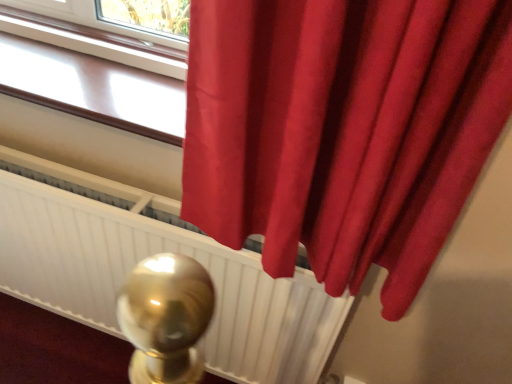
Measure the distance between white ribbed radiator at center and camera.

white ribbed radiator at center is 34.93 inches away from camera.

Measure the distance between point (66, 251) and camera.

Point (66, 251) is 1.16 meters away from camera.

What do you see at coordinates (146, 256) in the screenshot? I see `white ribbed radiator at center` at bounding box center [146, 256].

You are a GUI agent. You are given a task and a screenshot of the screen. Output one action in this format:
    pyautogui.click(x=<x>, y=<y>)
    Task: Click on the white ribbed radiator at center
    
    Given the screenshot: What is the action you would take?
    pyautogui.click(x=146, y=256)

This screenshot has width=512, height=384. Find the location of `white ribbed radiator at center`. white ribbed radiator at center is located at coordinates (146, 256).